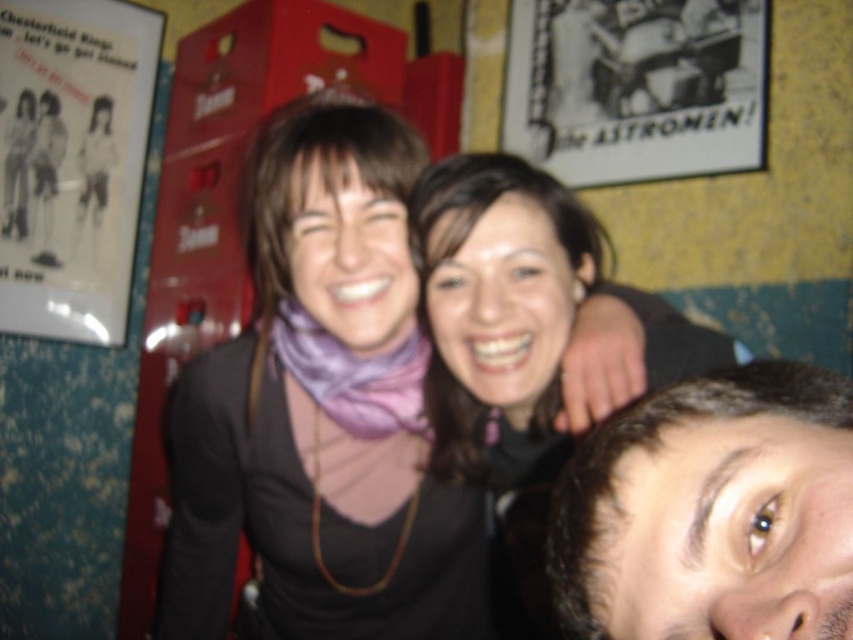
Is brown hair at upper right to the right of matte black sweater at center from the viewer's perspective?

Incorrect, brown hair at upper right is not on the right side of matte black sweater at center.

How much distance is there between brown hair at upper right and matte black sweater at center?

They are 15.59 inches apart.

At what (x,y) coordinates should I click in order to perform the action: click on brown hair at upper right. Please return your answer as a coordinate pair (x, y). Image resolution: width=853 pixels, height=640 pixels. Looking at the image, I should click on (711, 512).